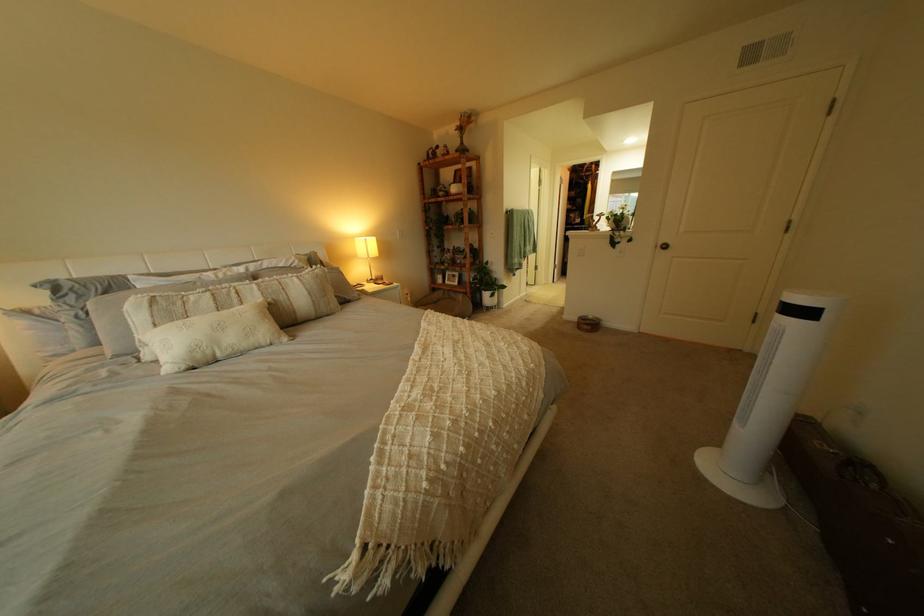
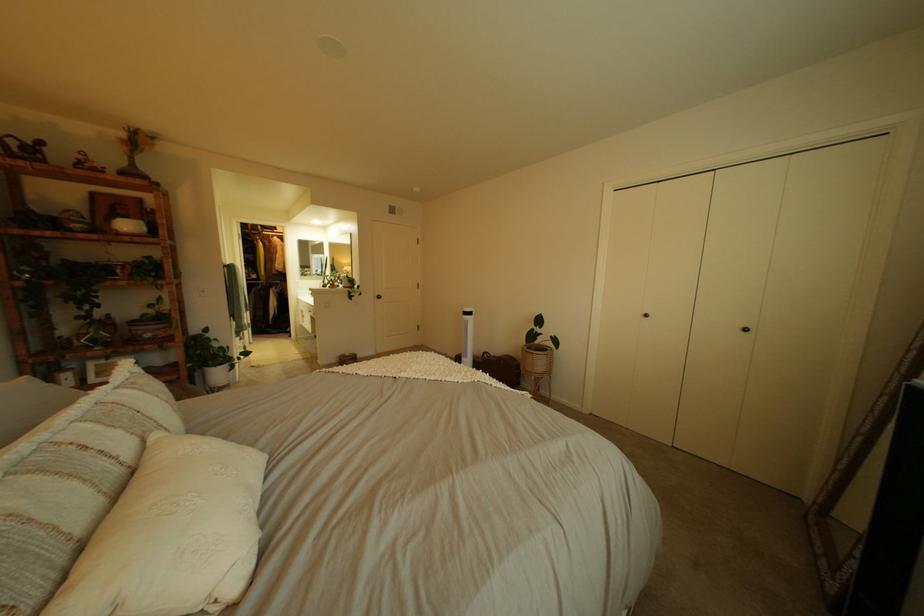
The point at (480, 292) is marked in the first image. Where is the corresponding point in the second image?

(189, 379)